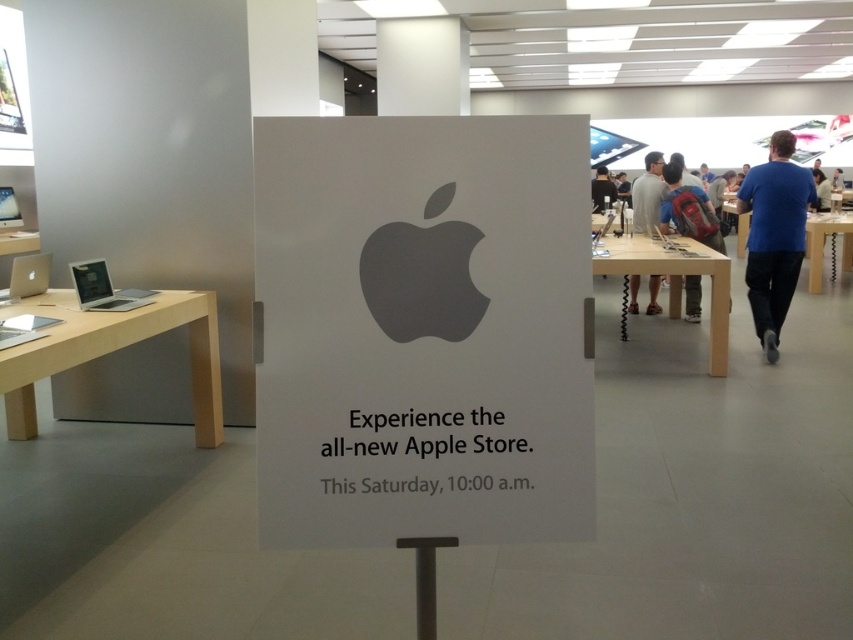
Question: Is white paper sign at center further to the viewer compared to blue fabric shirt at center?

Choices:
 (A) yes
 (B) no

Answer: (B)

Question: Is gray matte apple logo at center positioned before sleek silver laptop at left?

Choices:
 (A) yes
 (B) no

Answer: (A)

Question: Does gray matte apple logo at center come in front of red backpack at center?

Choices:
 (A) no
 (B) yes

Answer: (B)

Question: Which is nearer to the blue cotton shirt at right?

Choices:
 (A) gray matte apple logo at center
 (B) gray fabric shirt at center
 (C) black fabric shirt at center

Answer: (B)

Question: Which object appears closest to the camera in this image?

Choices:
 (A) silver metallic laptop at left
 (B) black fabric shirt at center
 (C) white paper sign at center

Answer: (C)

Question: Estimate the real-world distances between objects in this image. Which object is farther from the blue cotton shirt at right?

Choices:
 (A) gray fabric shirt at center
 (B) black fabric shirt at center

Answer: (B)